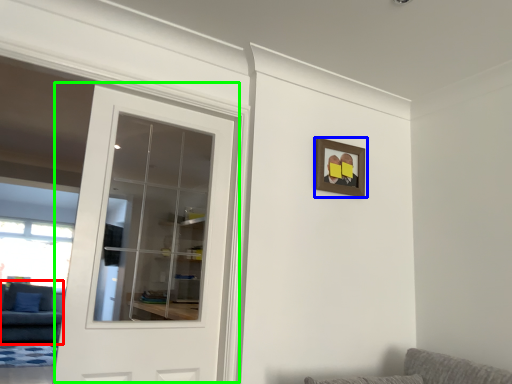
Question: Estimate the real-world distances between objects in this image. Which object is closer to couch (highlighted by a red box), picture frame (highlighted by a blue box) or door (highlighted by a green box)?

Choices:
 (A) picture frame
 (B) door

Answer: (B)